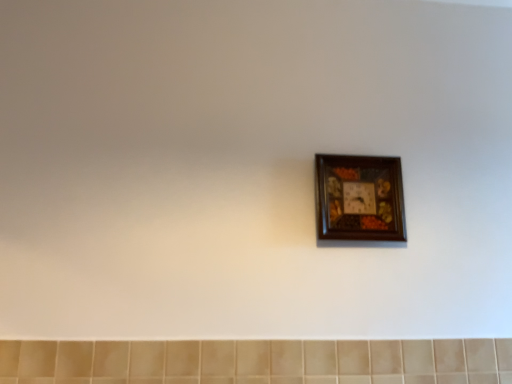
Question: Should I look upward or downward to see wooden picture frame at center?

Choices:
 (A) up
 (B) down

Answer: (B)

Question: Would you consider beige ceramic tile at bottom to be distant from wooden picture frame at center?

Choices:
 (A) no
 (B) yes

Answer: (A)

Question: Does beige ceramic tile at bottom appear on the right side of wooden picture frame at center?

Choices:
 (A) yes
 (B) no

Answer: (B)

Question: From the image's perspective, does beige ceramic tile at bottom appear higher than wooden picture frame at center?

Choices:
 (A) no
 (B) yes

Answer: (A)

Question: Considering the relative sizes of beige ceramic tile at bottom and wooden picture frame at center in the image provided, is beige ceramic tile at bottom shorter than wooden picture frame at center?

Choices:
 (A) no
 (B) yes

Answer: (B)

Question: Is beige ceramic tile at bottom oriented towards wooden picture frame at center?

Choices:
 (A) yes
 (B) no

Answer: (B)

Question: From a real-world perspective, is beige ceramic tile at bottom over wooden picture frame at center?

Choices:
 (A) yes
 (B) no

Answer: (B)

Question: Does wooden picture frame at center have a greater height compared to beige ceramic tile at bottom?

Choices:
 (A) no
 (B) yes

Answer: (B)

Question: Could you tell me if wooden picture frame at center is facing beige ceramic tile at bottom?

Choices:
 (A) no
 (B) yes

Answer: (A)

Question: Is wooden picture frame at center facing away from beige ceramic tile at bottom?

Choices:
 (A) yes
 (B) no

Answer: (B)

Question: From a real-world perspective, is wooden picture frame at center over beige ceramic tile at bottom?

Choices:
 (A) no
 (B) yes

Answer: (B)

Question: Is wooden picture frame at center completely or partially outside of beige ceramic tile at bottom?

Choices:
 (A) no
 (B) yes

Answer: (B)

Question: Is wooden picture frame at center directly adjacent to beige ceramic tile at bottom?

Choices:
 (A) no
 (B) yes

Answer: (A)

Question: Is wooden picture frame at center taller or shorter than beige ceramic tile at bottom?

Choices:
 (A) tall
 (B) short

Answer: (A)